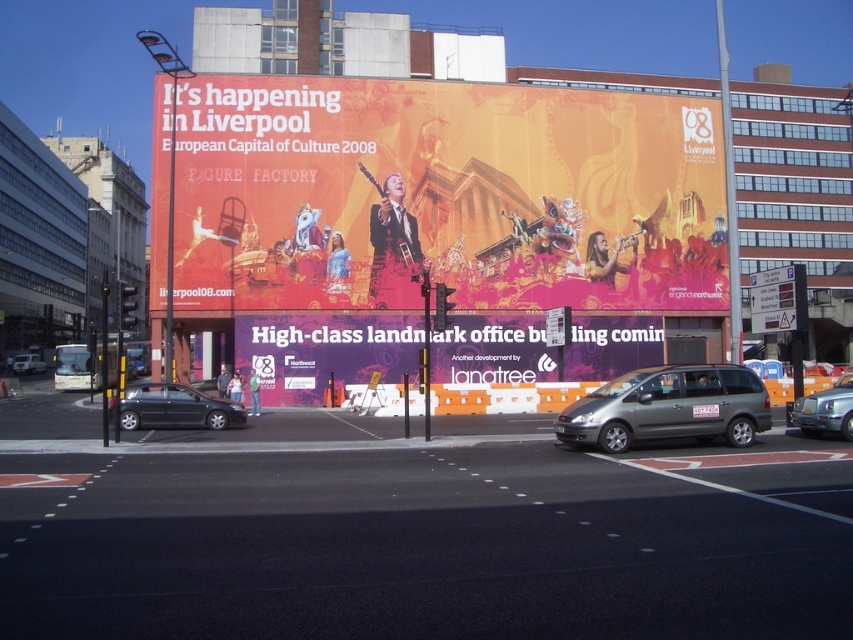
You are a delivery driver who needs to park your metallic gray minivan at center. The parking spot is located at coordinate point (668,406). Is your vehicle positioned correctly?

The point (668,406) marks the metallic gray minivan at center, so yes, the vehicle is positioned correctly at the specified coordinate.

You are standing in the middle of the street looking at the large orange and red billboard. There is a specific point at coordinates [445,196]. Which object does this point correspond to?

The point at coordinates [445,196] corresponds to the orange matte billboard at upper center.